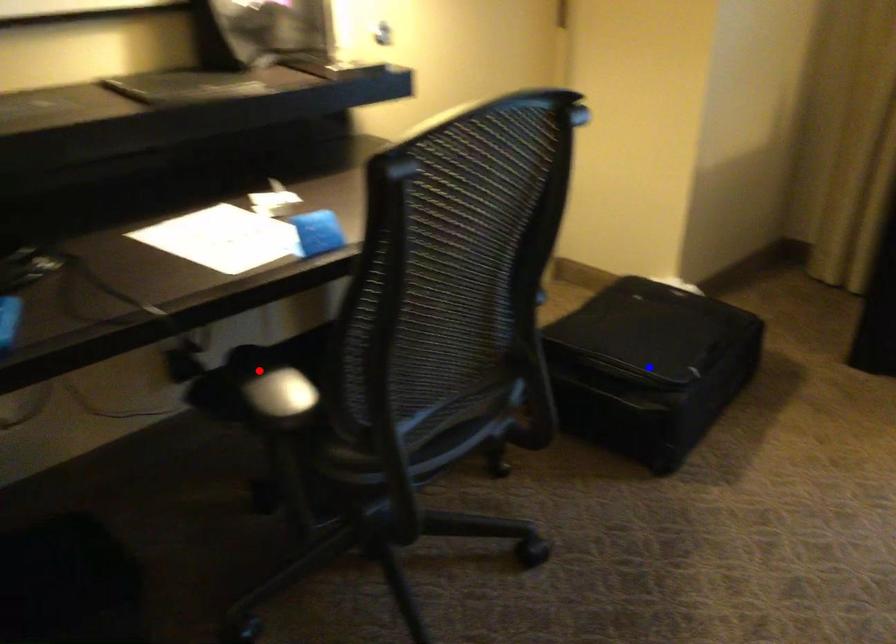
Question: Two points are marked on the image. Which point is closer to the camera?

Choices:
 (A) Blue point is closer.
 (B) Red point is closer.

Answer: (B)